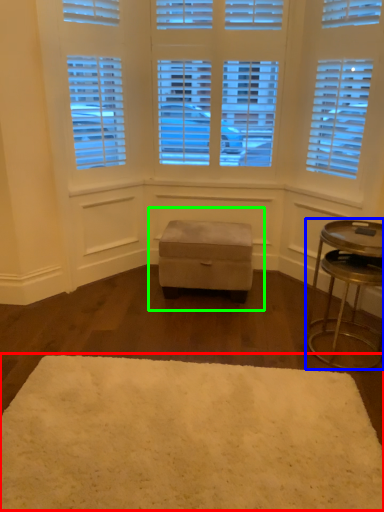
Question: Considering the real-world distances, which object is closest to mat (highlighted by a red box)? table (highlighted by a blue box) or music stool (highlighted by a green box).

Choices:
 (A) table
 (B) music stool

Answer: (A)